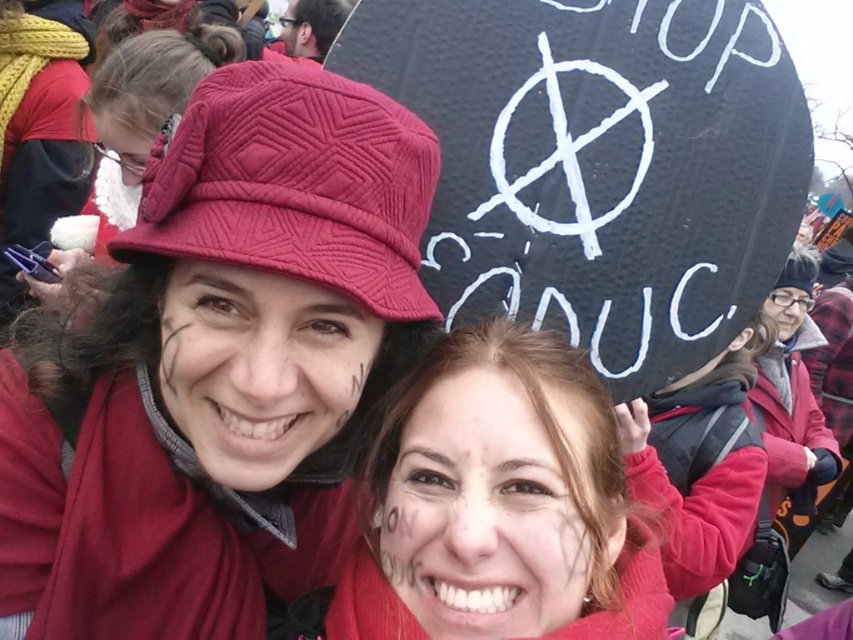
You are a photographer trying to capture a photo of the matte red hat at upper left and the quilted fabric hat at upper center. Which hat is positioned lower in the image?

The matte red hat at upper left is located below the quilted fabric hat at upper center, so it is positioned lower in the image.

You are a photographer trying to capture the matte red hat at upper left and the quilted fabric hat at upper center in a single frame. Which hat should you adjust your camera to focus on first to ensure both are in the shot?

The matte red hat at upper left is positioned on the right side of quilted fabric hat at upper center, so you should focus on the quilted fabric hat at upper center first to ensure both are included in the frame.